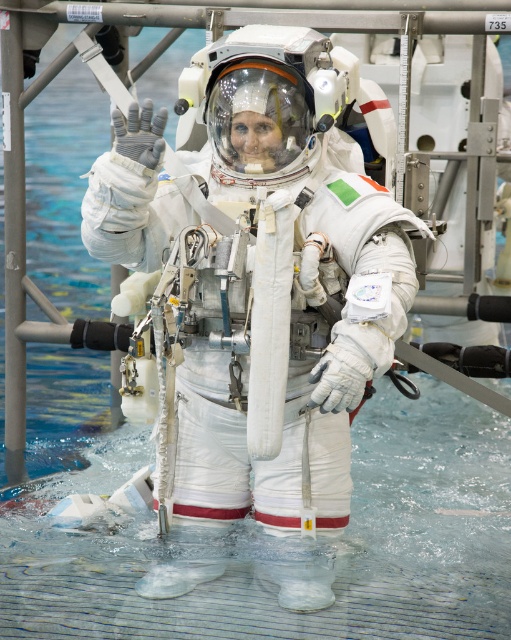
Question: Considering the relative positions of white matte spacesuit at center and clear plastic water at center in the image provided, where is white matte spacesuit at center located with respect to clear plastic water at center?

Choices:
 (A) right
 (B) left

Answer: (B)

Question: Does white matte spacesuit at center lie in front of clear plastic water at center?

Choices:
 (A) yes
 (B) no

Answer: (A)

Question: Among these points, which one is farthest from the camera?

Choices:
 (A) (345, 442)
 (B) (108, 461)

Answer: (B)

Question: Which of the following is the closest to the observer?

Choices:
 (A) clear plastic water at center
 (B) white matte spacesuit at center

Answer: (B)

Question: Is white matte spacesuit at center wider than clear plastic water at center?

Choices:
 (A) no
 (B) yes

Answer: (A)

Question: Among these objects, which one is nearest to the camera?

Choices:
 (A) white matte spacesuit at center
 (B) clear plastic water at center

Answer: (A)